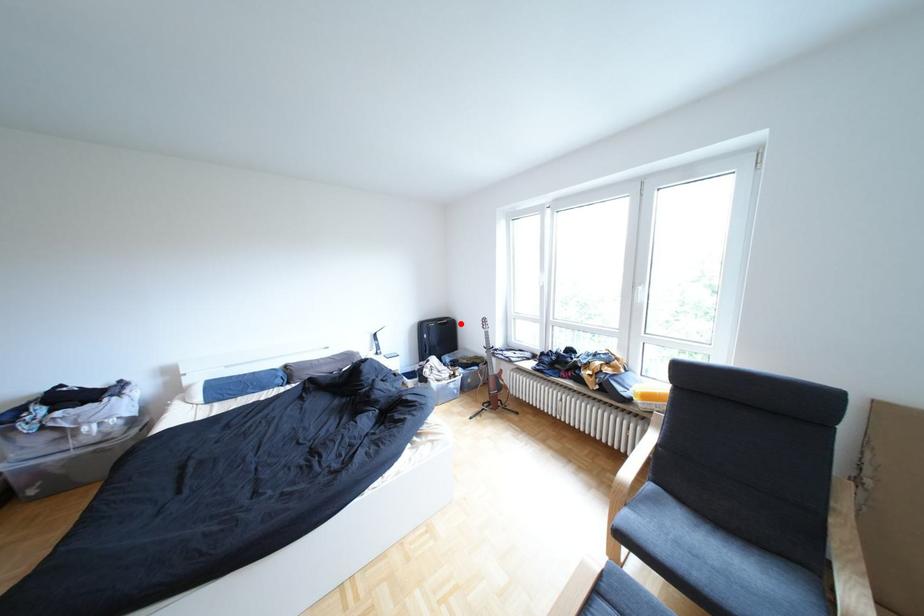
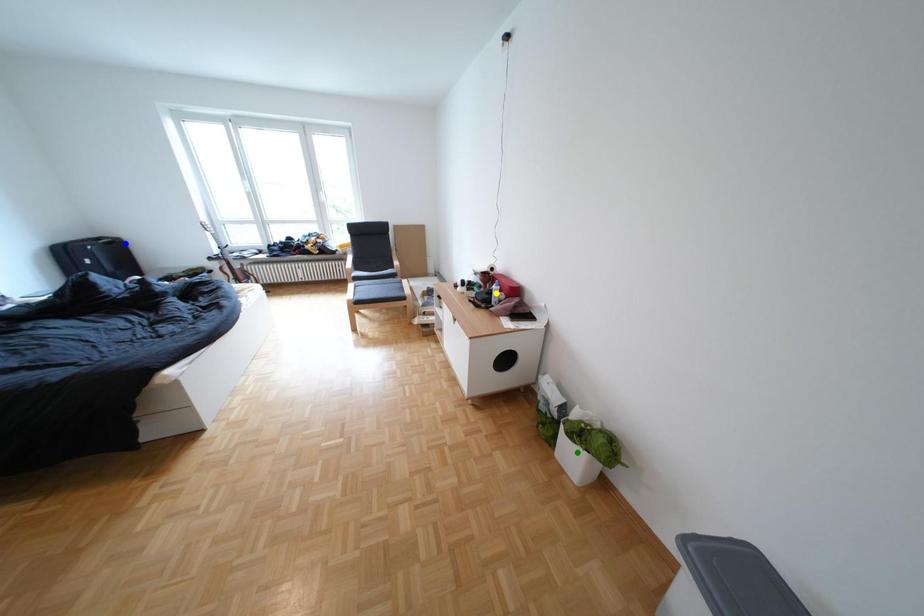
Question: I am providing you with two images of the same scene from different viewpoints. A red point is marked on the first image. You are given multiple points on the second image. Which spot in image 2 lines up with the point in image 1?

Choices:
 (A) blue point
 (B) green point
 (C) yellow point

Answer: (A)